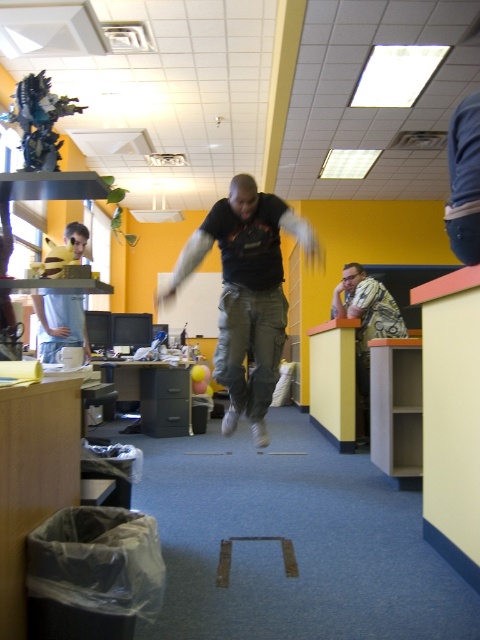
You are designing a virtual reality simulation of this office space. To accurately place the black matte shirt at center in the 3D environment, what are the coordinates you should use?

The coordinates for the black matte shirt at center are point (247, 292).

What is located at the coordinates point (247, 292)?

The black matte shirt at center is located at point (247, 292).